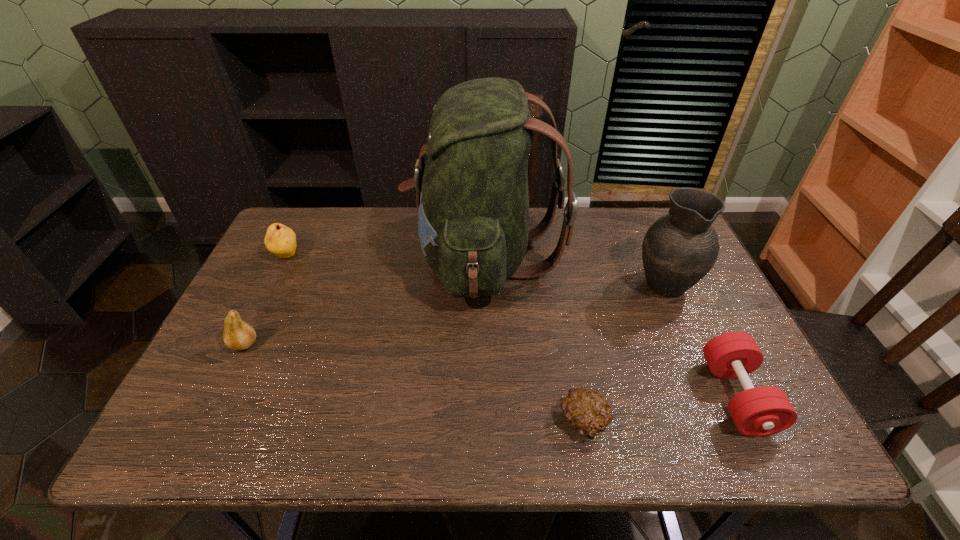
Identify the location of free space that is in between the fifth shortest object and the tallest object. This screenshot has height=540, width=960. (574, 270).

Where is `free space that is in between the pitcher and the shortest object`? The height and width of the screenshot is (540, 960). free space that is in between the pitcher and the shortest object is located at coordinates (624, 353).

You are a GUI agent. You are given a task and a screenshot of the screen. Output one action in this format:
    pyautogui.click(x=<x>, y=<y>)
    Task: Click on the free space between the tallest object and the dumbbell
    This screenshot has height=540, width=960.
    Given the screenshot: What is the action you would take?
    pyautogui.click(x=611, y=327)

Locate an element on the screen. Image resolution: width=960 pixels, height=540 pixels. free spot between the farther pear and the muffin is located at coordinates (435, 339).

You are a GUI agent. You are given a task and a screenshot of the screen. Output one action in this format:
    pyautogui.click(x=<x>, y=<y>)
    Task: Click on the free space between the dumbbell and the fourth farthest object
    The width and height of the screenshot is (960, 540).
    Given the screenshot: What is the action you would take?
    pyautogui.click(x=491, y=370)

Find the location of a particular element. The width and height of the screenshot is (960, 540). vacant area between the fifth shortest object and the shortest object is located at coordinates (624, 353).

You are a GUI agent. You are given a task and a screenshot of the screen. Output one action in this format:
    pyautogui.click(x=<x>, y=<y>)
    Task: Click on the free point between the muffin and the second tallest object
    
    Given the screenshot: What is the action you would take?
    pyautogui.click(x=624, y=353)

Locate an element on the screen. Image resolution: width=960 pixels, height=540 pixels. unoccupied position between the pitcher and the shortest object is located at coordinates (624, 353).

Locate an element on the screen. The image size is (960, 540). the fifth closest object relative to the third nearest object is located at coordinates (761, 411).

Locate an element on the screen. the fourth closest object relative to the shortest object is located at coordinates (238, 335).